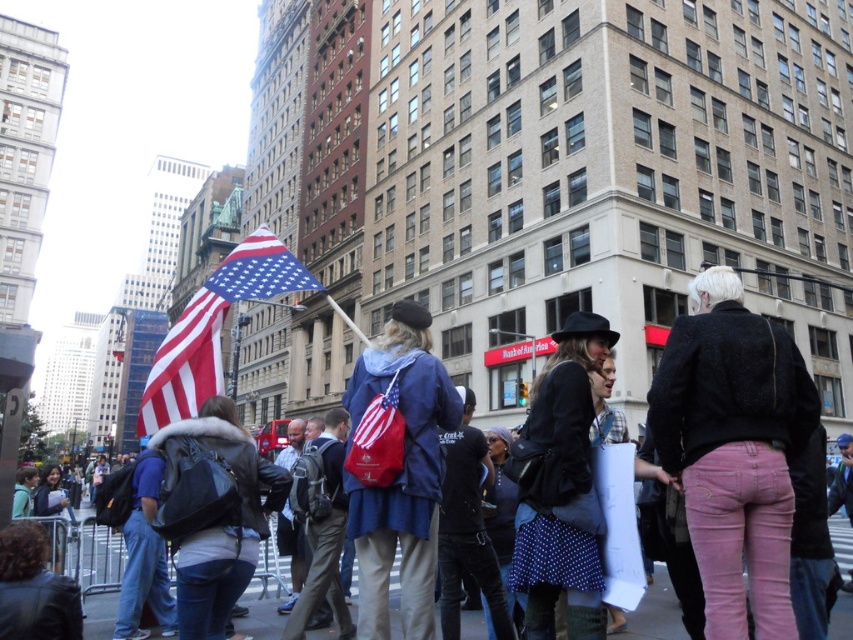
Consider the image. You are a photographer trying to capture a photo of the american flag at center and the blue denim jacket at center. If you want both subjects to be in focus, which one should you focus on first?

The american flag at center is much taller than the blue denim jacket at center, so you should focus on the american flag at center first to ensure both are in focus.

You are standing at the origin point in the city street scene. There are two points marked in the image. Which point is closer to you, point (167, 376) or point (677, 616)?

Point (677, 616) is closer to you because the description states that point (167, 376) is behind point (677, 616).

You are a photographer standing at the camera position and want to capture a photo of the american flag at center. Considering the distance between you and the flag, what is the minimum focal length lens you should use to ensure the entire flag fits within the frame of your camera?

To determine the minimum focal length required, you would need to know the sensor size of your camera and the desired field of view. However, given the distance of 103.42 feet between you and the american flag at center, a longer focal length lens would be necessary to zoom in and ensure the flag fills the frame appropriately.